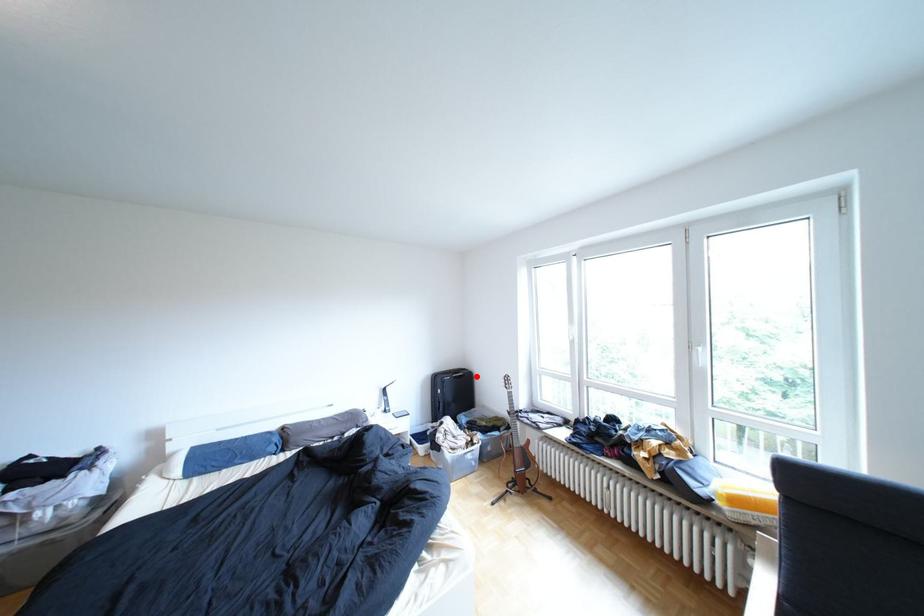
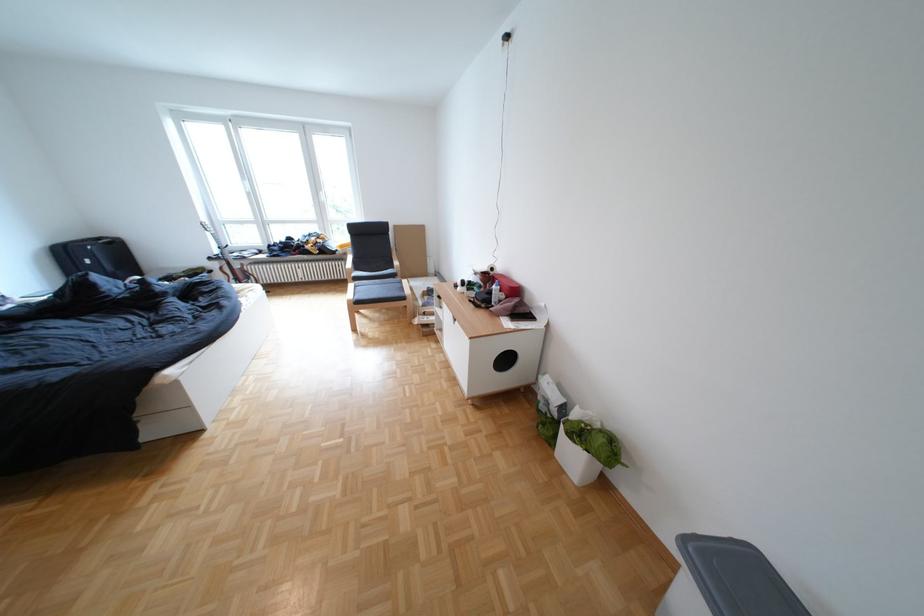
Locate, in the second image, the point that corresponds to the highlighted location in the first image.

(126, 244)